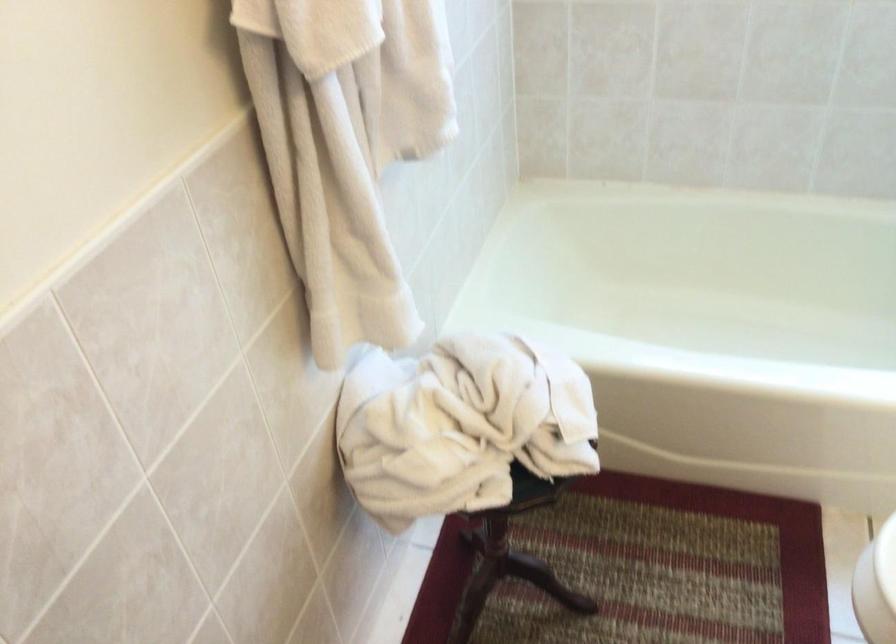
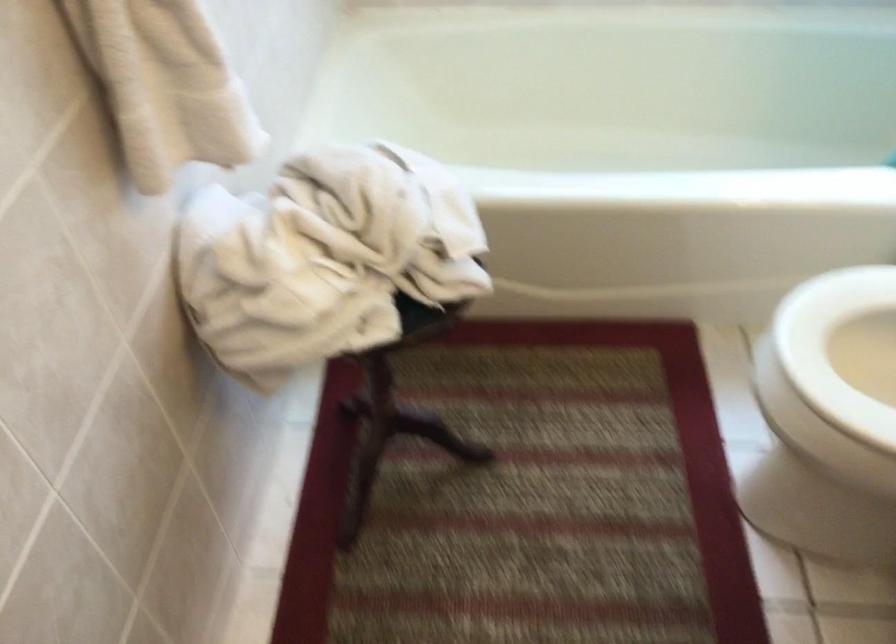
Question: The camera is either moving clockwise (left) or counter-clockwise (right) around the object. The first image is from the beginning of the video and the second image is from the end. Is the camera moving left or right when shooting the video?

Choices:
 (A) Left
 (B) Right

Answer: (A)